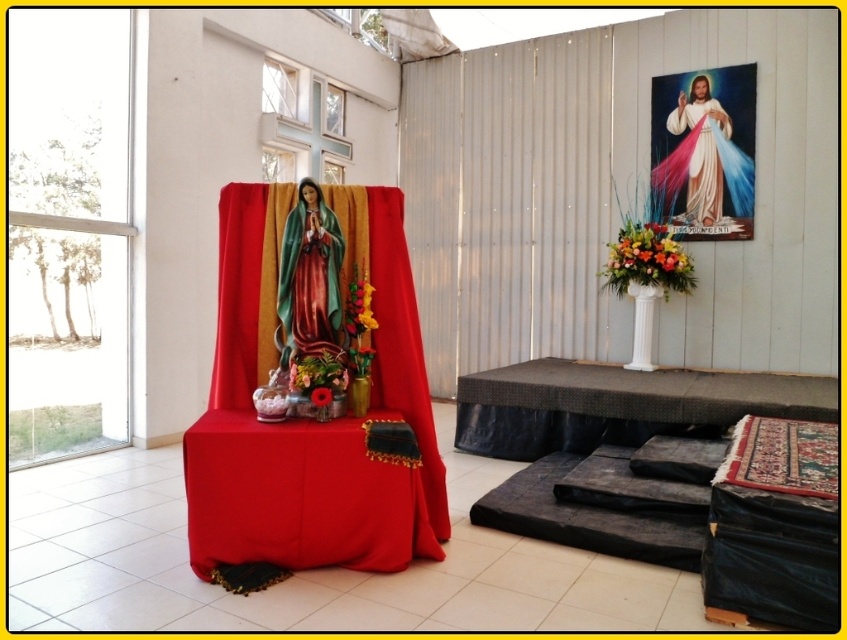
Does velvet red table at center come in front of black textured table at lower right?

Yes, velvet red table at center is closer to the viewer.

Is velvet red table at center thinner than black textured table at lower right?

Yes.

Where is `velvet red table at center`? The width and height of the screenshot is (847, 640). velvet red table at center is located at coordinates (309, 493).

At what (x,y) coordinates should I click in order to perform the action: click on velvet red table at center. Please return your answer as a coordinate pair (x, y). The width and height of the screenshot is (847, 640). Looking at the image, I should click on (309, 493).

Between velvet red table at center and white silk robe at upper right, which one has less height?

Standing shorter between the two is velvet red table at center.

Does velvet red table at center come behind white silk robe at upper right?

No.

Is point (313, 529) farther from viewer compared to point (690, 179)?

No, it is in front of (690, 179).

This screenshot has width=847, height=640. I want to click on velvet red table at center, so click(x=309, y=493).

Measure the distance between shiny green robe at center and camera.

3.10 meters

Describe the element at coordinates (309, 280) in the screenshot. The height and width of the screenshot is (640, 847). I see `shiny green robe at center` at that location.

Does point (281, 296) come behind point (692, 120)?

No, it is not.

The image size is (847, 640). Identify the location of shiny green robe at center. (309, 280).